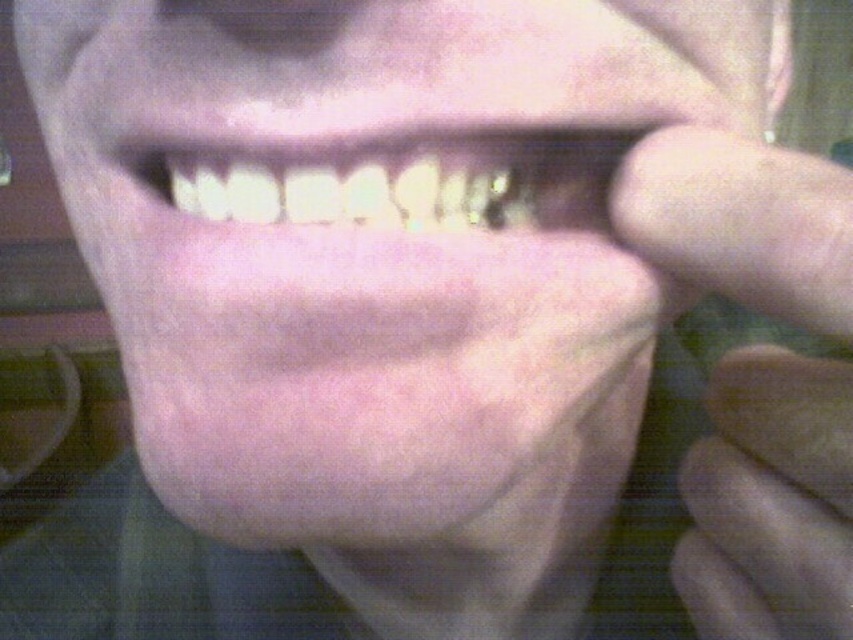
Question: Does smooth skin hand at right have a greater width compared to white glossy teeth at center?

Choices:
 (A) no
 (B) yes

Answer: (A)

Question: Which point is closer to the camera?

Choices:
 (A) white glossy teeth at center
 (B) smooth skin hand at right

Answer: (B)

Question: Can you confirm if smooth skin hand at right is positioned to the right of white glossy teeth at center?

Choices:
 (A) yes
 (B) no

Answer: (A)

Question: Among these objects, which one is farthest from the camera?

Choices:
 (A) smooth skin hand at right
 (B) white glossy teeth at center

Answer: (B)

Question: Is smooth skin hand at right positioned at the back of white glossy teeth at center?

Choices:
 (A) yes
 (B) no

Answer: (B)